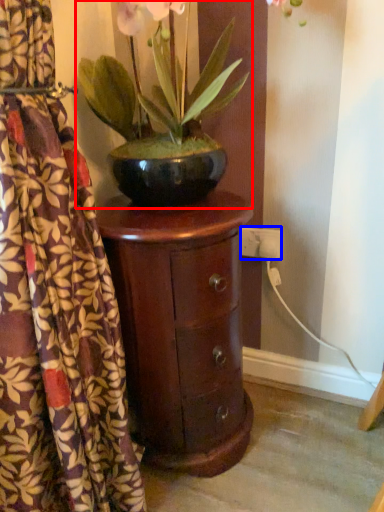
Question: Which of the following is the closest to the observer, houseplant (highlighted by a red box) or electric outlet (highlighted by a blue box)?

Choices:
 (A) houseplant
 (B) electric outlet

Answer: (A)